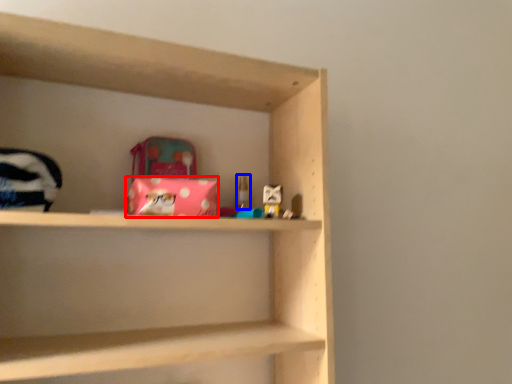
Question: Among these objects, which one is nearest to the camera, material (highlighted by a red box) or toy (highlighted by a blue box)?

Choices:
 (A) material
 (B) toy

Answer: (A)